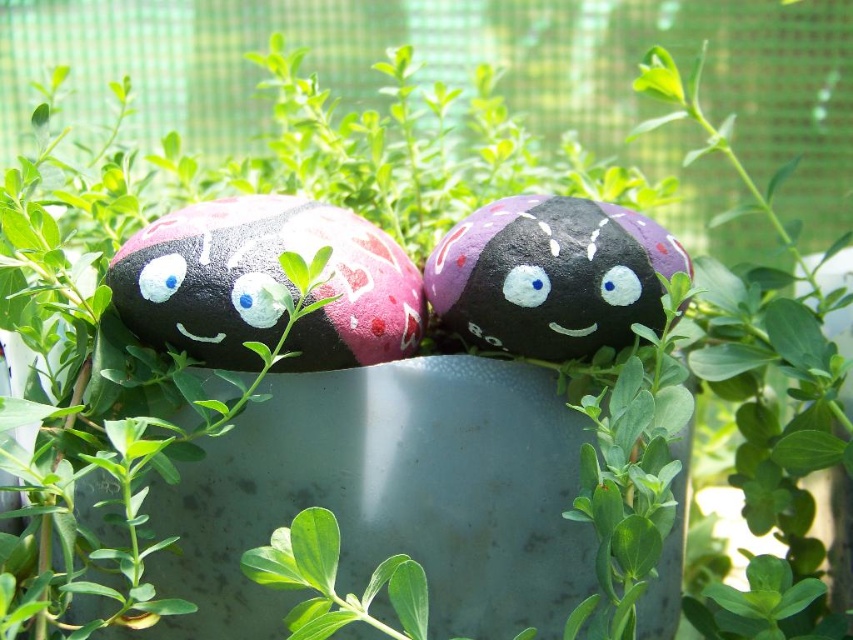
Consider the image. You are a painter who wants to add a new design to the purple matte rock at center and the matte white eye at center. Which object should you paint first if you want to start with the one that is higher up?

The purple matte rock at center should be painted first because it is located above the matte white eye at center.

You are standing in front of the two painted rocks. You notice two points marked on the rocks. The first point is at coordinate point (677,256) and the second is at point (254,275). Which point is closer to you?

Point (677,256) is further to the camera than point (254,275), so the point closer to you is point (254,275).

You are an artist planning to paint a new rock to place between the existing rocks. You want to ensure your rock is placed so that it is to the right of the matte pink rock at center and to the left of the white matte eye at center. Is this possible?

Yes, it is possible to place your new rock between the matte pink rock at center and the white matte eye at center since the matte pink rock at center is already positioned to the left of the white matte eye at center, allowing space in between.